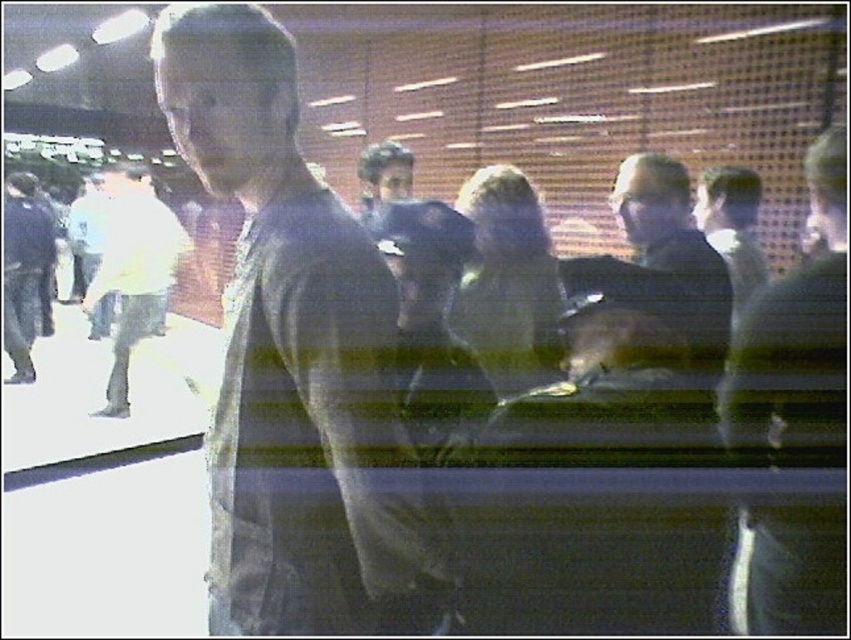
Can you confirm if dark gray shirt at center is positioned to the right of white matte shirt at left?

Indeed, dark gray shirt at center is positioned on the right side of white matte shirt at left.

Between dark gray shirt at center and white matte shirt at left, which one appears on the left side from the viewer's perspective?

white matte shirt at left is more to the left.

You are a GUI agent. You are given a task and a screenshot of the screen. Output one action in this format:
    pyautogui.click(x=<x>, y=<y>)
    Task: Click on the dark gray shirt at center
    The width and height of the screenshot is (851, 640).
    Given the screenshot: What is the action you would take?
    pyautogui.click(x=294, y=358)

You are a GUI agent. You are given a task and a screenshot of the screen. Output one action in this format:
    pyautogui.click(x=<x>, y=<y>)
    Task: Click on the dark gray shirt at center
    
    Given the screenshot: What is the action you would take?
    pyautogui.click(x=294, y=358)